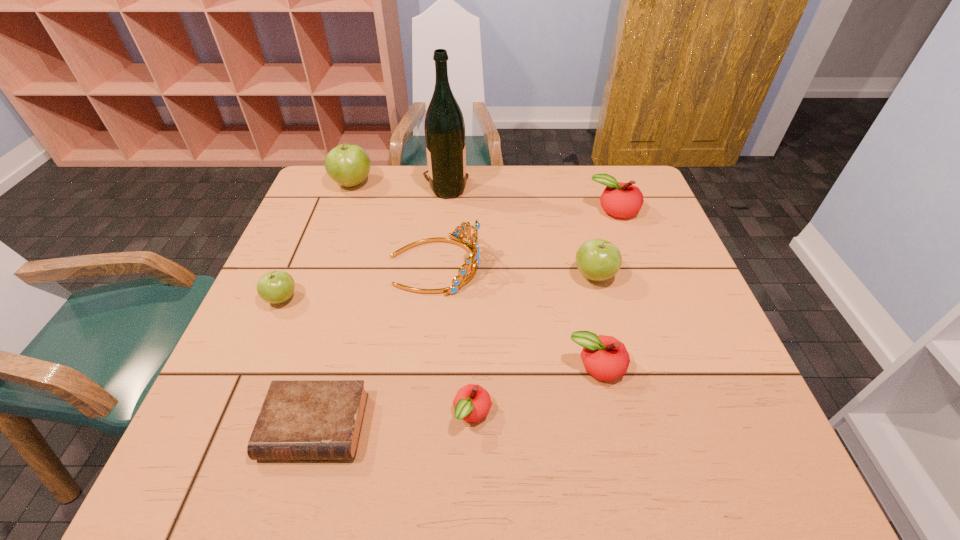
Where is `the second farthest red apple`? The width and height of the screenshot is (960, 540). the second farthest red apple is located at coordinates (605, 358).

The width and height of the screenshot is (960, 540). In order to click on the smallest red apple in this screenshot , I will do `click(472, 402)`.

Image resolution: width=960 pixels, height=540 pixels. Identify the location of the nearest apple. (472, 402).

The image size is (960, 540). I want to click on diary, so click(x=300, y=419).

Find the location of `free space located 0.340m on the right of the tallest object`. free space located 0.340m on the right of the tallest object is located at coordinates (579, 187).

The width and height of the screenshot is (960, 540). I want to click on vacant space located 0.340m on the right of the tallest apple, so click(483, 184).

Locate an element on the screen. free space located on the front-facing side of the tiara is located at coordinates (516, 265).

The height and width of the screenshot is (540, 960). I want to click on vacant position located 0.120m on the right of the second smallest green apple, so click(665, 276).

You are a GUI agent. You are given a task and a screenshot of the screen. Output one action in this format:
    pyautogui.click(x=<x>, y=<y>)
    Task: Click on the vacant region located 0.070m on the front of the biggest red apple
    
    Given the screenshot: What is the action you would take?
    pyautogui.click(x=624, y=240)

Find the location of a particular element. This screenshot has width=960, height=540. free spot located on the back of the smallest green apple is located at coordinates (307, 238).